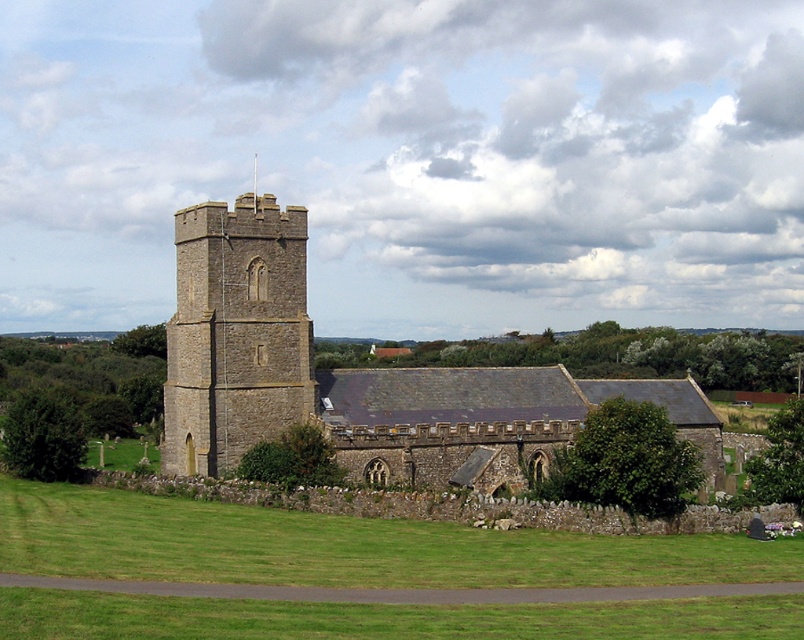
Who is more distant from viewer, (277,216) or (241,426)?

Positioned behind is point (277,216).

Is point (314, 394) positioned after point (171, 342)?

That is False.

Which is in front, point (236, 396) or point (175, 308)?

Point (236, 396)

Find the location of a particular element. This screenshot has width=804, height=640. brown stone church at center is located at coordinates (355, 376).

Which is in front, point (531, 572) or point (300, 260)?

Point (531, 572) is in front.

Locate an element on the screen. The height and width of the screenshot is (640, 804). green grass at lower center is located at coordinates point(343,547).

Who is shorter, green grass at lower center or brown stone church at center?

green grass at lower center is shorter.

Between point (528, 552) and point (211, 320), which one is positioned behind?

The point (211, 320) is behind.

Identify the location of green grass at lower center. (343, 547).